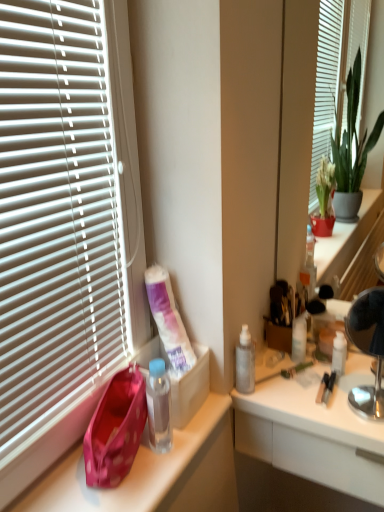
Find the location of a particular element. The width and height of the screenshot is (384, 512). free space to the back side of metallic silver lamp at right is located at coordinates (342, 372).